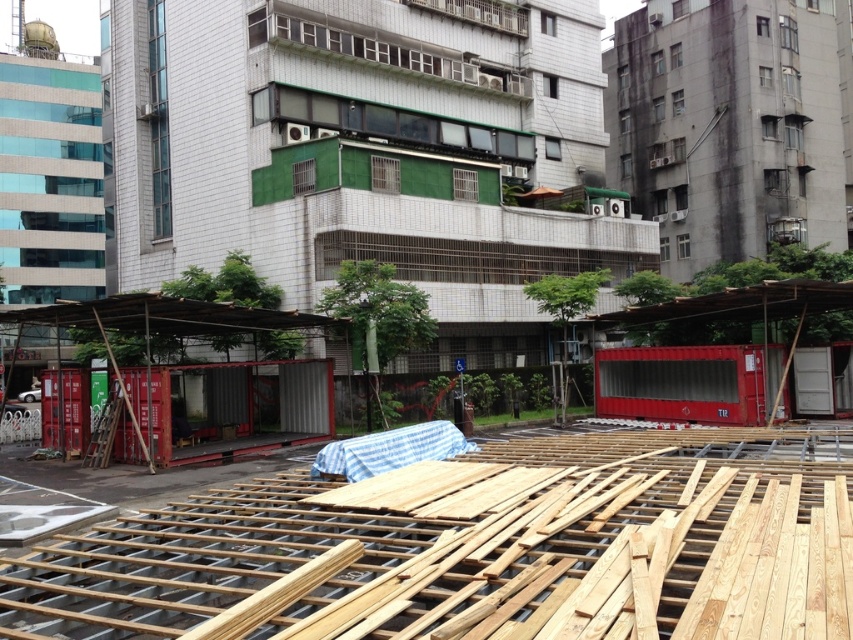
Who is positioned more to the left, metallic shipping container at center or natural wood planks at center?

metallic shipping container at center

Which is behind, point (422, 104) or point (312, 547)?

The point (422, 104) is more distant.

Image resolution: width=853 pixels, height=640 pixels. What do you see at coordinates (366, 152) in the screenshot?
I see `metallic shipping container at center` at bounding box center [366, 152].

Where is `metallic shipping container at center`? This screenshot has width=853, height=640. metallic shipping container at center is located at coordinates (366, 152).